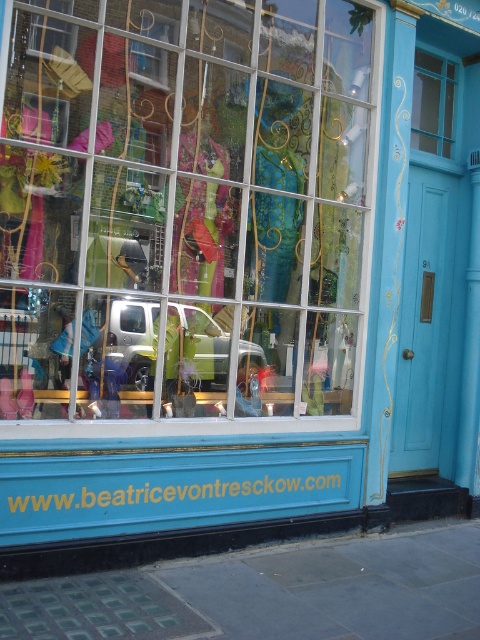
You are standing at the entrance of the shop and want to locate two points marked on the window. The first point is at coordinate point (261, 138) and the second is at point (144, 74). Which point is closer to the entrance?

Point (144, 74) is closer to the entrance because it is in front of point (261, 138).

You are a delivery person holding a package that needs to be placed on the counter inside the store. The counter is located behind the transparent glass window at upper right. However, you can only reach up to 2 meters. Can you reach the counter through the clear glass window at upper center?

The transparent glass window at upper right is 2.35 meters away from the clear glass window at upper center. Since your maximum reach is 2 meters, you cannot reach the counter through the clear glass window at upper center as it is farther than your reach.

You are a photographer trying to capture the storefront of the shop. You notice the metallic silver car at center and the clear glass window at upper center. Which object would require a wider lens to capture its full width in a single photo?

The metallic silver car at center would require a wider lens because its width is larger than the clear glass window at upper center, necessitating a lens that can accommodate its broader size.